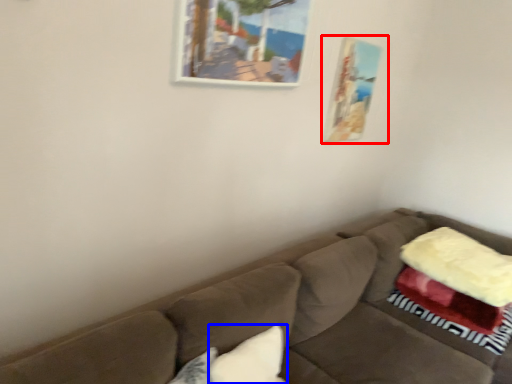
Question: Which object is closer to the camera taking this photo, picture frame (highlighted by a red box) or pillow (highlighted by a blue box)?

Choices:
 (A) picture frame
 (B) pillow

Answer: (B)